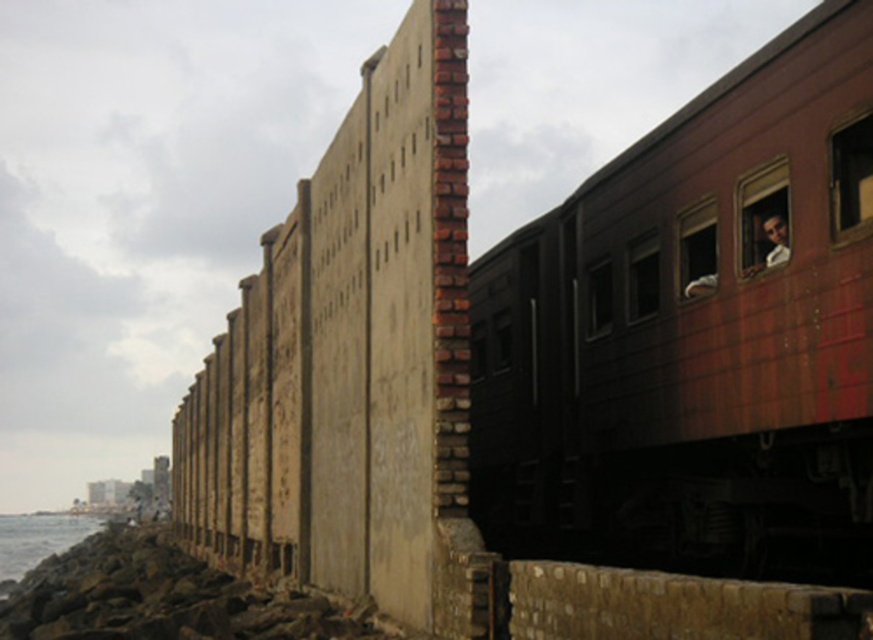
You are standing on a platform next to the gray rocky water at lower left and want to board the rusty metal train at right. Is the train elevated enough for you to climb aboard without needing a ladder?

The rusty metal train at right is above gray rocky water at lower left, so the train is elevated enough for you to climb aboard without needing a ladder.